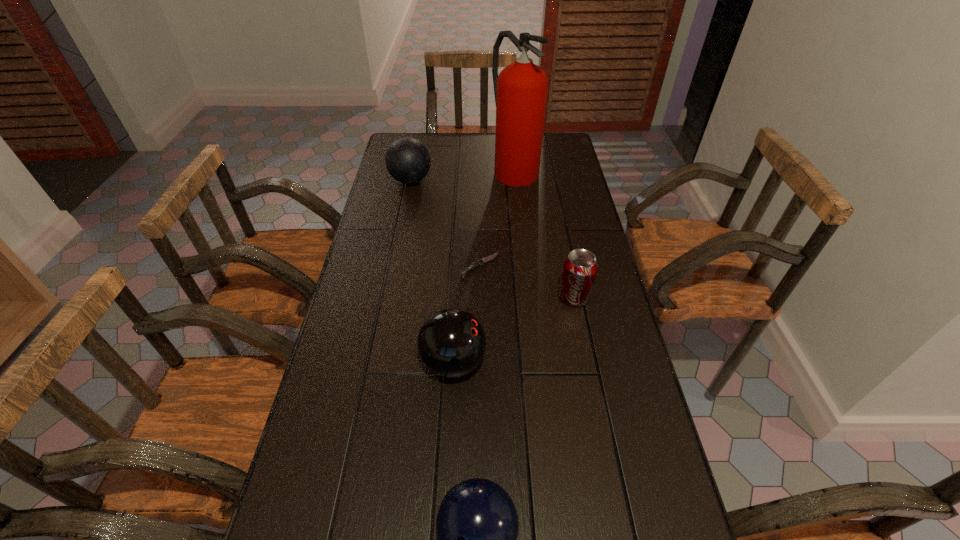
This screenshot has height=540, width=960. Find the location of `vacant region located 0.390m on the front of the third nearest object`. vacant region located 0.390m on the front of the third nearest object is located at coordinates (604, 441).

Locate an element on the screen. free space located 0.250m on the right of the fourth nearest object is located at coordinates (578, 266).

Find the location of a particular element. The height and width of the screenshot is (540, 960). object present at the far edge is located at coordinates (520, 90).

Identify the location of object present at the left edge. The height and width of the screenshot is (540, 960). (407, 159).

This screenshot has height=540, width=960. I want to click on fire extinguisher that is at the right edge, so click(520, 90).

Identify the location of soda can located in the right edge section of the desktop. (580, 267).

The image size is (960, 540). Find the location of `object that is at the far right corner`. object that is at the far right corner is located at coordinates (520, 90).

The height and width of the screenshot is (540, 960). Identify the location of free region at the far edge of the desktop. (462, 145).

This screenshot has height=540, width=960. Find the location of `vacant space at the left edge of the desktop`. vacant space at the left edge of the desktop is located at coordinates (345, 310).

The image size is (960, 540). In order to click on vacant area at the right edge of the desktop in this screenshot , I will do `click(579, 232)`.